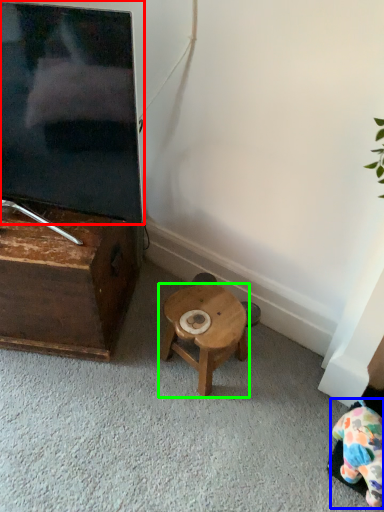
Question: Considering the real-world distances, which object is closest to television (highlighted by a red box)? toy (highlighted by a blue box) or stool (highlighted by a green box).

Choices:
 (A) toy
 (B) stool

Answer: (B)